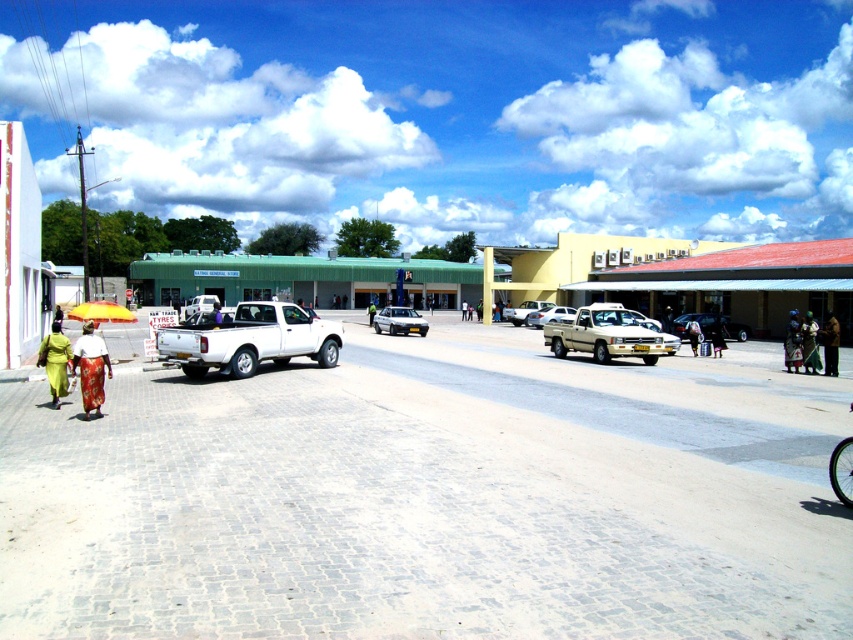
Question: Can you confirm if matte white pickup truck at center is bigger than silver metallic sedan at center?

Choices:
 (A) no
 (B) yes

Answer: (B)

Question: Does beige matte pickup truck at center have a larger size compared to matte yellow umbrella at lower left?

Choices:
 (A) no
 (B) yes

Answer: (B)

Question: Can you confirm if green fabric dress at lower left is positioned above brown fabric bag at right?

Choices:
 (A) yes
 (B) no

Answer: (B)

Question: Which point is farther to the camera?

Choices:
 (A) matte white pickup truck at center
 (B) white glossy pickup truck at center
 (C) metallic silver car at center
 (D) dark blue fabric bag at right

Answer: (C)

Question: Among these objects, which one is farthest from the camera?

Choices:
 (A) green fabric dress at lower left
 (B) matte white pickup truck at center
 (C) dark blue fabric bag at right
 (D) brown fabric bag at right

Answer: (B)

Question: Which object is farther from the camera taking this photo?

Choices:
 (A) dark blue fabric bag at center right
 (B) dark blue fabric bag at right
 (C) matte yellow umbrella at lower left

Answer: (B)